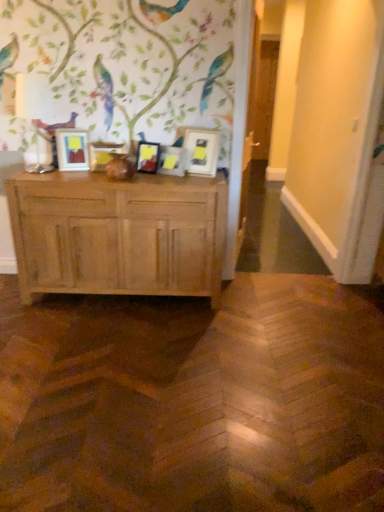
Question: From a real-world perspective, is matte white picture frame at center, marked as the fourth picture frame in a left-to-right arrangement, physically below matte wooden picture frame at left, the fifth picture frame from the right?

Choices:
 (A) yes
 (B) no

Answer: (A)

Question: Is matte white picture frame at center, marked as the fourth picture frame in a left-to-right arrangement, thinner than matte wooden picture frame at left, the fifth picture frame from the right?

Choices:
 (A) yes
 (B) no

Answer: (A)

Question: From a real-world perspective, is matte white picture frame at center, marked as the fourth picture frame in a left-to-right arrangement, positioned over matte wooden picture frame at left, arranged as the first picture frame when viewed from the left, based on gravity?

Choices:
 (A) no
 (B) yes

Answer: (A)

Question: Considering the relative sizes of matte white picture frame at center, the second picture frame when ordered from right to left, and matte wooden picture frame at left, arranged as the first picture frame when viewed from the left, in the image provided, is matte white picture frame at center, the second picture frame when ordered from right to left, shorter than matte wooden picture frame at left, arranged as the first picture frame when viewed from the left,?

Choices:
 (A) no
 (B) yes

Answer: (B)

Question: Can you confirm if matte white picture frame at center, the second picture frame when ordered from right to left, is bigger than matte wooden picture frame at left, the fifth picture frame from the right?

Choices:
 (A) yes
 (B) no

Answer: (B)

Question: Considering the positions of matte white picture frame at center, the second picture frame when ordered from right to left, and matte wooden picture frame at center, which is the 2th picture frame from left to right, in the image, is matte white picture frame at center, the second picture frame when ordered from right to left, taller or shorter than matte wooden picture frame at center, which is the 2th picture frame from left to right,?

Choices:
 (A) short
 (B) tall

Answer: (B)

Question: From a real-world perspective, is matte white picture frame at center, marked as the fourth picture frame in a left-to-right arrangement, above or below matte wooden picture frame at center, which appears as the fourth picture frame when viewed from the right?

Choices:
 (A) below
 (B) above

Answer: (A)

Question: Visually, is matte white picture frame at center, marked as the fourth picture frame in a left-to-right arrangement, positioned to the left or to the right of matte wooden picture frame at center, which appears as the fourth picture frame when viewed from the right?

Choices:
 (A) right
 (B) left

Answer: (A)

Question: In terms of size, does matte white picture frame at center, marked as the fourth picture frame in a left-to-right arrangement, appear bigger or smaller than matte wooden picture frame at center, which appears as the fourth picture frame when viewed from the right?

Choices:
 (A) big
 (B) small

Answer: (B)

Question: From the image's perspective, is matte white picture frame at center, which ranks as the 5th picture frame in left-to-right order, positioned above or below light brown wood chest of drawers at center?

Choices:
 (A) below
 (B) above

Answer: (B)

Question: Based on their sizes in the image, would you say matte white picture frame at center, which ranks as the 5th picture frame in left-to-right order, is bigger or smaller than light brown wood chest of drawers at center?

Choices:
 (A) small
 (B) big

Answer: (A)

Question: Is point (190, 138) closer or farther from the camera than point (140, 229)?

Choices:
 (A) closer
 (B) farther

Answer: (B)

Question: In terms of height, does matte white picture frame at center, the 1th picture frame in the right-to-left sequence, look taller or shorter compared to light brown wood chest of drawers at center?

Choices:
 (A) short
 (B) tall

Answer: (A)

Question: From a real-world perspective, is matte white picture frame at center, which ranks as the 5th picture frame in left-to-right order, positioned above or below matte wooden picture frame at center, which ranks as the third picture frame in left-to-right order?

Choices:
 (A) below
 (B) above

Answer: (B)

Question: From the image's perspective, is matte white picture frame at center, which ranks as the 5th picture frame in left-to-right order, positioned above or below matte wooden picture frame at center, which appears as the third picture frame when viewed from the right?

Choices:
 (A) above
 (B) below

Answer: (A)